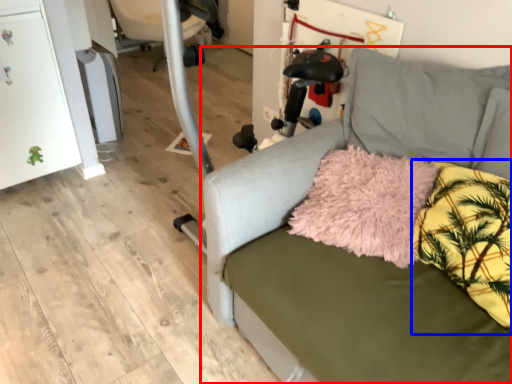
Question: Which object is closer to the camera taking this photo, studio couch (highlighted by a red box) or pillow (highlighted by a blue box)?

Choices:
 (A) studio couch
 (B) pillow

Answer: (A)